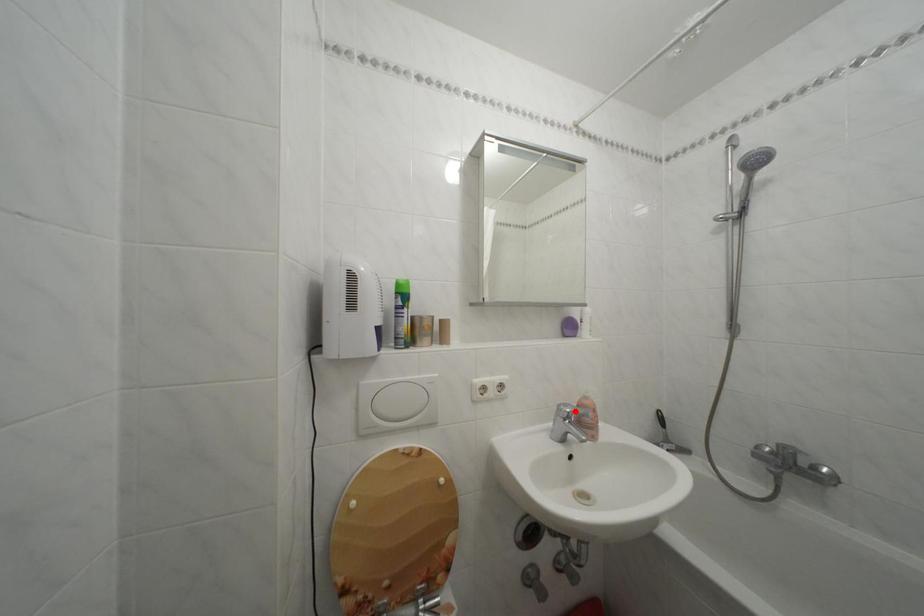
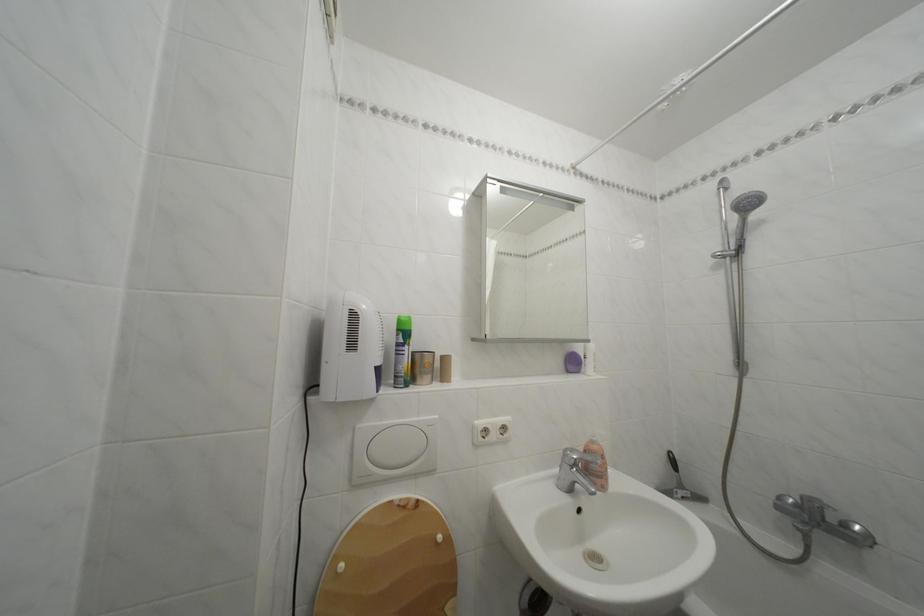
The point at the highlighted location is marked in the first image. Where is the corresponding point in the second image?

(581, 456)